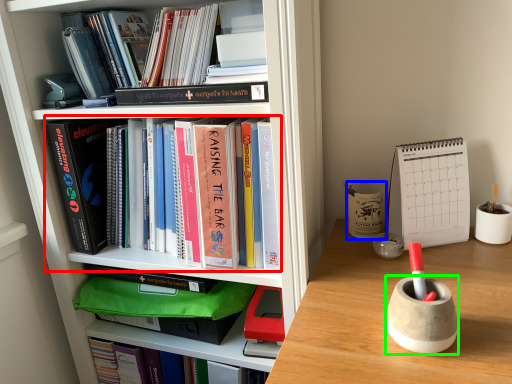
Question: Which object is positioned farthest from book (highlighted by a red box)? Select from stationery (highlighted by a blue box) and stationery (highlighted by a green box).

Choices:
 (A) stationery
 (B) stationery

Answer: (B)